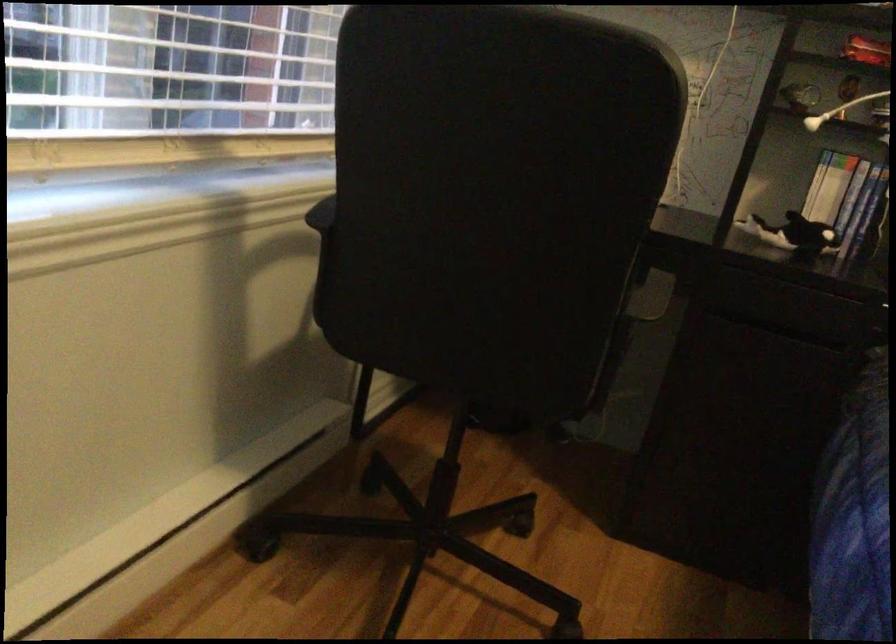
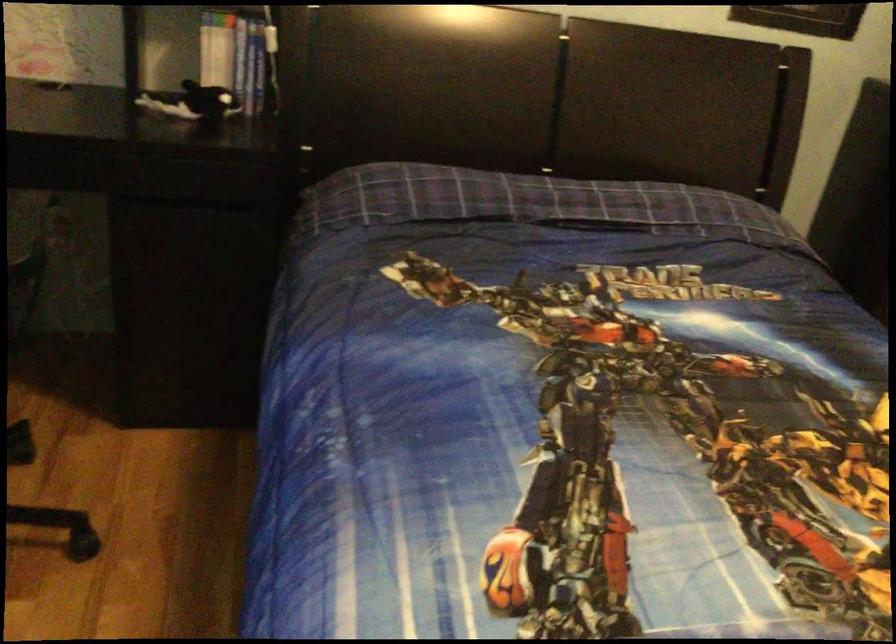
How did the camera likely rotate?

The camera rotated toward right-down.